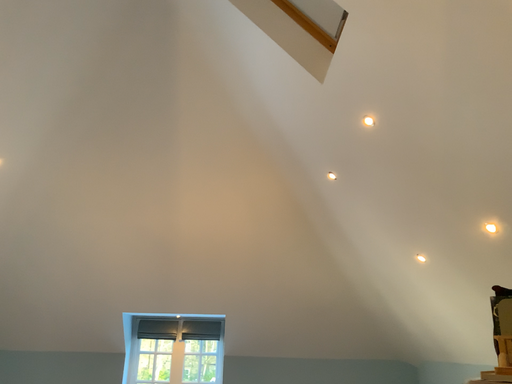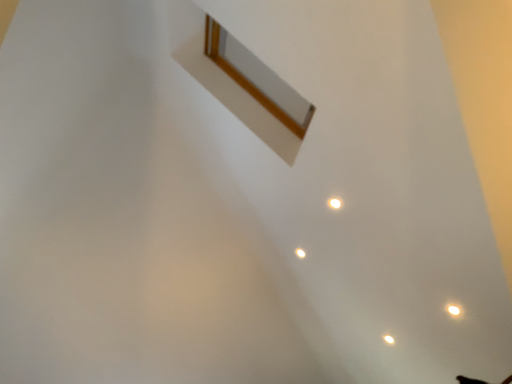
Question: How did the camera likely rotate when shooting the video?

Choices:
 (A) rotated downward
 (B) rotated upward

Answer: (B)